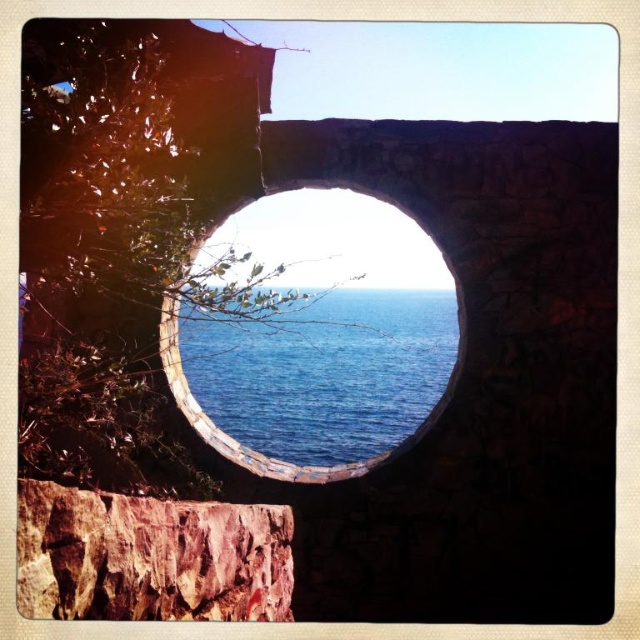
Between rustic stone cliff at center and smooth stone hole at center, which one is positioned lower?

Positioned lower is smooth stone hole at center.

Who is taller, rustic stone cliff at center or smooth stone hole at center?

smooth stone hole at center is taller.

What do you see at coordinates (148, 556) in the screenshot? The image size is (640, 640). I see `rustic stone cliff at center` at bounding box center [148, 556].

Find the location of a particular element. rustic stone cliff at center is located at coordinates (148, 556).